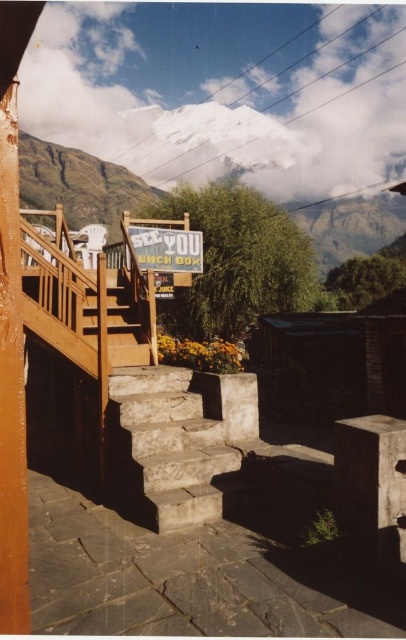
Who is positioned more to the left, stone textured stairs at center or wooden stairs at center?

wooden stairs at center

From the picture: Which of these two, stone textured stairs at center or wooden stairs at center, stands shorter?

Standing shorter between the two is stone textured stairs at center.

Which is in front, point (172, 460) or point (101, 266)?

Point (172, 460)

The image size is (406, 640). Identify the location of stone textured stairs at center. (164, 449).